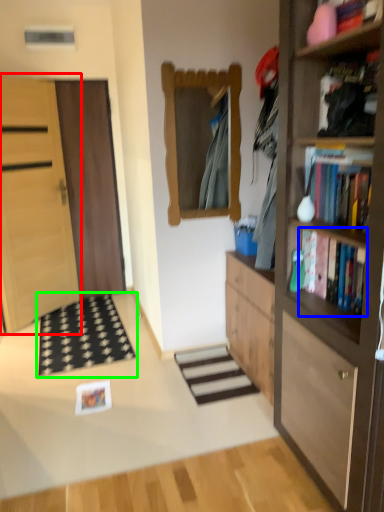
Question: Estimate the real-world distances between objects in this image. Which object is closer to door (highlighted by a red box), book (highlighted by a blue box) or doormat (highlighted by a green box)?

Choices:
 (A) book
 (B) doormat

Answer: (B)